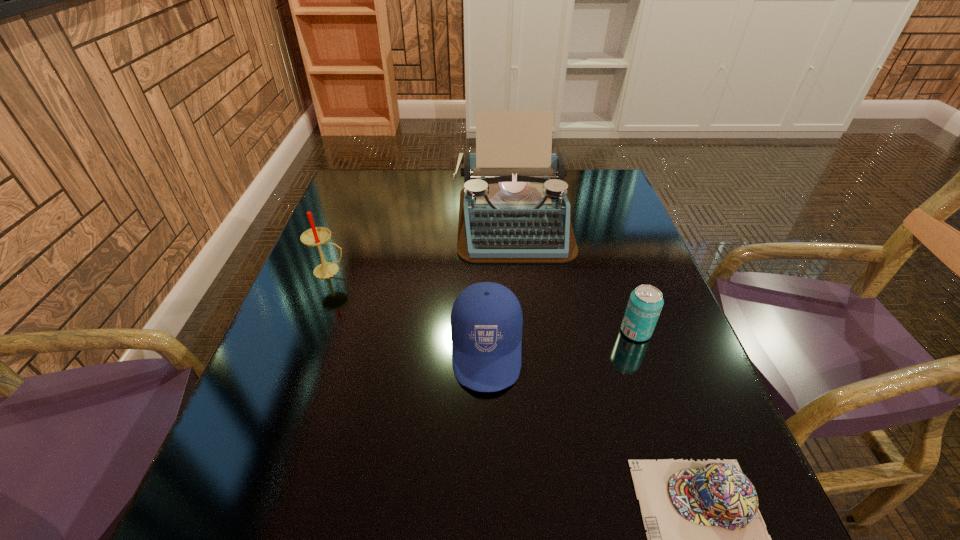
Identify the location of typewriter. The width and height of the screenshot is (960, 540). (514, 209).

What are the coordinates of `the leftmost object` in the screenshot? It's located at (315, 236).

Identify the location of candle. This screenshot has width=960, height=540. (315, 236).

The image size is (960, 540). Find the location of `the farther cap`. the farther cap is located at coordinates (486, 319).

In order to click on the left cap in this screenshot , I will do `click(486, 319)`.

The height and width of the screenshot is (540, 960). I want to click on beer can, so click(645, 303).

Identify the location of free region located on the typing side of the tallest object. (519, 288).

Where is `blank space located on the right of the fourth shortest object`? blank space located on the right of the fourth shortest object is located at coordinates (442, 271).

You are a GUI agent. You are given a task and a screenshot of the screen. Output one action in this format:
    pyautogui.click(x=<x>, y=<y>)
    Task: Click on the free space located on the front-facing side of the taller cap
    Image resolution: width=960 pixels, height=540 pixels.
    Given the screenshot: What is the action you would take?
    pyautogui.click(x=489, y=524)

I want to click on vacant area situated on the front of the beer can, so click(667, 423).